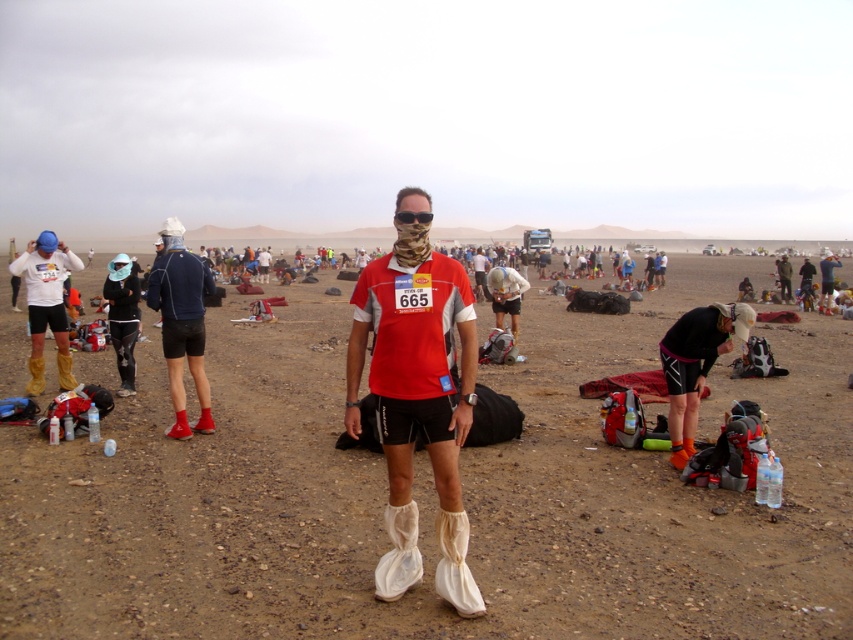
You are a participant in the desert race and need to place your blue jacket on the ground near the center. Based on the scene, where should you place the matte blue jacket at left relative to the brown sandy dirt at center?

The brown sandy dirt at center is above the matte blue jacket at left, so you should place the matte blue jacket at left below the brown sandy dirt at center.